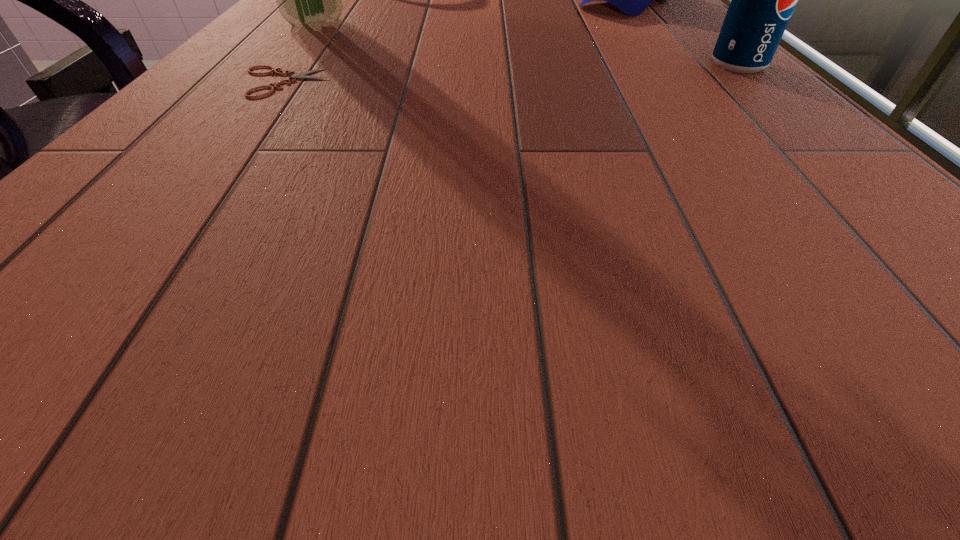
At what (x,y) coordinates should I click in order to perform the action: click on shears. Please return your answer as a coordinate pair (x, y). Looking at the image, I should click on (294, 76).

Identify the location of pop. This screenshot has height=540, width=960. (762, 0).

You are a GUI agent. You are given a task and a screenshot of the screen. Output one action in this format:
    pyautogui.click(x=<x>, y=<y>)
    Task: Click on the tallest object
    Image resolution: width=960 pixels, height=540 pixels.
    Given the screenshot: What is the action you would take?
    pyautogui.click(x=309, y=0)

Locate an element on the screen. This screenshot has height=540, width=960. free location located on the back of the shortest object is located at coordinates (339, 8).

The image size is (960, 540). In order to click on vacant space located on the front of the pop in this screenshot , I will do [880, 199].

You are a GUI agent. You are given a task and a screenshot of the screen. Output one action in this format:
    pyautogui.click(x=<x>, y=<y>)
    Task: Click on the vacant space located on the front-facing side of the bouquet
    This screenshot has height=540, width=960.
    Given the screenshot: What is the action you would take?
    pyautogui.click(x=390, y=44)

The height and width of the screenshot is (540, 960). I want to click on vacant region located 0.250m on the front-facing side of the bouquet, so click(x=431, y=56).

You are a GUI agent. You are given a task and a screenshot of the screen. Output one action in this format:
    pyautogui.click(x=<x>, y=<y>)
    Task: Click on the vacant region located 0.350m on the front-facing side of the bouquet
    The width and height of the screenshot is (960, 540).
    Given the screenshot: What is the action you would take?
    pyautogui.click(x=476, y=69)

Locate an element on the screen. shears that is at the left edge is located at coordinates (294, 76).

This screenshot has width=960, height=540. Find the location of `bouquet at the left edge`. bouquet at the left edge is located at coordinates (309, 0).